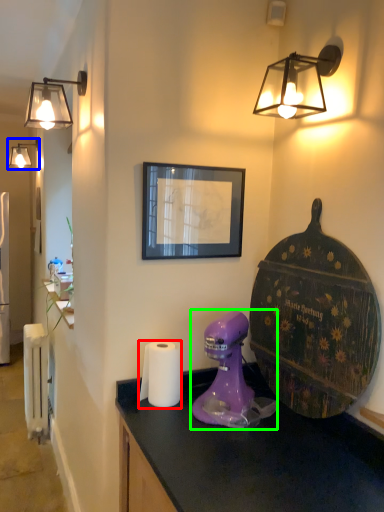
Question: Based on their relative distances, which object is farther from toilet paper (highlighted by a red box)? Choose from lamp (highlighted by a blue box) and mixer (highlighted by a green box).

Choices:
 (A) lamp
 (B) mixer

Answer: (A)